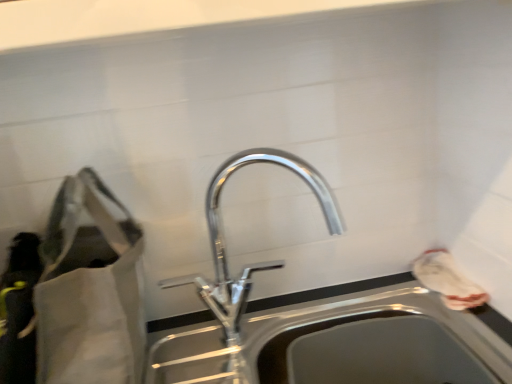
Measure the distance between polished chrome tap at center and camera.

polished chrome tap at center is 29.58 inches away from camera.

Identify the location of polished chrome tap at center. (224, 247).

In the scene shown: From the image's perspective, is white fabric bag at right, arranged as the 2th bag when viewed from the left, located beneath stainless steel sink at center?

Actually, white fabric bag at right, arranged as the 2th bag when viewed from the left, appears above stainless steel sink at center in the image.

From the picture: Between white fabric bag at right, the 1th bag positioned from the right, and stainless steel sink at center, which one is positioned behind?

white fabric bag at right, the 1th bag positioned from the right.

From a real-world perspective, is white fabric bag at right, the 1th bag positioned from the right, positioned above or below stainless steel sink at center?

In terms of real-world spatial position, white fabric bag at right, the 1th bag positioned from the right, is above stainless steel sink at center.

Is white fabric bag at right, the 1th bag positioned from the right, placed right next to stainless steel sink at center?

No, white fabric bag at right, the 1th bag positioned from the right, is not in contact with stainless steel sink at center.

Could you measure the distance between stainless steel sink at center and white fabric bag at right, arranged as the 2th bag when viewed from the left?

stainless steel sink at center is 19.29 centimeters from white fabric bag at right, arranged as the 2th bag when viewed from the left.

In the image, is stainless steel sink at center positioned in front of or behind white fabric bag at right, the 1th bag positioned from the right?

stainless steel sink at center is positioned closer to the viewer than white fabric bag at right, the 1th bag positioned from the right.

Which object is positioned more to the left, stainless steel sink at center or white fabric bag at right, the 1th bag positioned from the right?

stainless steel sink at center.

From the image's perspective, which object appears higher, stainless steel sink at center or white fabric bag at right, arranged as the 2th bag when viewed from the left?

white fabric bag at right, arranged as the 2th bag when viewed from the left, appears higher in the image.

From the image's perspective, is white fabric bag at right, the 1th bag positioned from the right, over polished chrome tap at center?

Actually, white fabric bag at right, the 1th bag positioned from the right, appears below polished chrome tap at center in the image.

How different are the orientations of white fabric bag at right, the 1th bag positioned from the right, and polished chrome tap at center in degrees?

The angular difference between white fabric bag at right, the 1th bag positioned from the right, and polished chrome tap at center is 92.7 degrees.

Between white fabric bag at right, the 1th bag positioned from the right, and polished chrome tap at center, which one is positioned behind?

white fabric bag at right, the 1th bag positioned from the right, is further away from the camera.

Considering the relative sizes of white fabric bag at right, arranged as the 2th bag when viewed from the left, and polished chrome tap at center in the image provided, is white fabric bag at right, arranged as the 2th bag when viewed from the left, wider than polished chrome tap at center?

No.

From the image's perspective, which object appears higher, matte gray bag at left, positioned as the first bag in left-to-right order, or stainless steel sink at center?

matte gray bag at left, positioned as the first bag in left-to-right order.

Looking at this image, considering the sizes of objects matte gray bag at left, positioned as the 2th bag in right-to-left order, and stainless steel sink at center in the image provided, who is thinner, matte gray bag at left, positioned as the 2th bag in right-to-left order, or stainless steel sink at center?

Thinner between the two is stainless steel sink at center.

Would you say matte gray bag at left, positioned as the 2th bag in right-to-left order, contains stainless steel sink at center?

Actually, stainless steel sink at center is outside matte gray bag at left, positioned as the 2th bag in right-to-left order.

Is matte gray bag at left, positioned as the 2th bag in right-to-left order, positioned with its back to stainless steel sink at center?

No, matte gray bag at left, positioned as the 2th bag in right-to-left order, is not facing away from stainless steel sink at center.

Does polished chrome tap at center have a lesser width compared to white fabric bag at right, the 1th bag positioned from the right?

No.

Does polished chrome tap at center appear on the left side of white fabric bag at right, the 1th bag positioned from the right?

Correct, you'll find polished chrome tap at center to the left of white fabric bag at right, the 1th bag positioned from the right.

In the image, is polished chrome tap at center positioned in front of or behind white fabric bag at right, arranged as the 2th bag when viewed from the left?

Clearly, polished chrome tap at center is in front of white fabric bag at right, arranged as the 2th bag when viewed from the left.

Is polished chrome tap at center next to white fabric bag at right, the 1th bag positioned from the right?

No, polished chrome tap at center is not touching white fabric bag at right, the 1th bag positioned from the right.

Based on their sizes in the image, would you say white fabric bag at right, arranged as the 2th bag when viewed from the left, is bigger or smaller than matte gray bag at left, positioned as the first bag in left-to-right order?

Considering their sizes, white fabric bag at right, arranged as the 2th bag when viewed from the left, takes up less space than matte gray bag at left, positioned as the first bag in left-to-right order.

Considering the relative sizes of white fabric bag at right, the 1th bag positioned from the right, and matte gray bag at left, positioned as the first bag in left-to-right order, in the image provided, is white fabric bag at right, the 1th bag positioned from the right, thinner than matte gray bag at left, positioned as the first bag in left-to-right order,?

Correct, the width of white fabric bag at right, the 1th bag positioned from the right, is less than that of matte gray bag at left, positioned as the first bag in left-to-right order.

In the scene shown: Does white fabric bag at right, the 1th bag positioned from the right, appear on the left side of matte gray bag at left, positioned as the first bag in left-to-right order?

In fact, white fabric bag at right, the 1th bag positioned from the right, is to the right of matte gray bag at left, positioned as the first bag in left-to-right order.

Locate an element on the screen. This screenshot has width=512, height=384. bag that appears above the white fabric bag at right, arranged as the 2th bag when viewed from the left (from a real-world perspective) is located at coordinates (90, 290).

From the image's perspective, which object appears higher, polished chrome tap at center or matte gray bag at left, positioned as the first bag in left-to-right order?

polished chrome tap at center.

Consider the image. From a real-world perspective, is polished chrome tap at center over matte gray bag at left, positioned as the 2th bag in right-to-left order?

No, from a real-world perspective, polished chrome tap at center is not over matte gray bag at left, positioned as the 2th bag in right-to-left order

Are polished chrome tap at center and matte gray bag at left, positioned as the 2th bag in right-to-left order, located far from each other?

Actually, polished chrome tap at center and matte gray bag at left, positioned as the 2th bag in right-to-left order, are a little close together.

Who is shorter, polished chrome tap at center or matte gray bag at left, positioned as the first bag in left-to-right order?

polished chrome tap at center.

The width and height of the screenshot is (512, 384). I want to click on the 1st bag above when counting from the stainless steel sink at center (from the image's perspective), so click(x=448, y=280).

Where is `sink on the left of white fabric bag at right, arranged as the 2th bag when viewed from the left`? Image resolution: width=512 pixels, height=384 pixels. sink on the left of white fabric bag at right, arranged as the 2th bag when viewed from the left is located at coordinates (341, 344).

From the image, which object appears to be nearer to white fabric bag at right, arranged as the 2th bag when viewed from the left, matte gray bag at left, positioned as the first bag in left-to-right order, or stainless steel sink at center?

stainless steel sink at center.

Looking at the image, which one is located further to stainless steel sink at center, white fabric bag at right, arranged as the 2th bag when viewed from the left, or polished chrome tap at center?

white fabric bag at right, arranged as the 2th bag when viewed from the left, lies further to stainless steel sink at center than the other object.

Estimate the real-world distances between objects in this image. Which object is further from stainless steel sink at center, matte gray bag at left, positioned as the first bag in left-to-right order, or polished chrome tap at center?

The object further to stainless steel sink at center is matte gray bag at left, positioned as the first bag in left-to-right order.

When comparing their distances from polished chrome tap at center, does matte gray bag at left, positioned as the first bag in left-to-right order, or white fabric bag at right, the 1th bag positioned from the right, seem further?

white fabric bag at right, the 1th bag positioned from the right, lies further to polished chrome tap at center than the other object.

Considering their positions, is polished chrome tap at center positioned closer to white fabric bag at right, arranged as the 2th bag when viewed from the left, than stainless steel sink at center?

stainless steel sink at center.

Estimate the real-world distances between objects in this image. Which object is further from matte gray bag at left, positioned as the first bag in left-to-right order, polished chrome tap at center or stainless steel sink at center?

Based on the image, stainless steel sink at center appears to be further to matte gray bag at left, positioned as the first bag in left-to-right order.

Looking at the image, which one is located further to polished chrome tap at center, matte gray bag at left, positioned as the first bag in left-to-right order, or stainless steel sink at center?

Based on the image, matte gray bag at left, positioned as the first bag in left-to-right order, appears to be further to polished chrome tap at center.

Considering their positions, is stainless steel sink at center positioned closer to polished chrome tap at center than matte gray bag at left, positioned as the 2th bag in right-to-left order?

stainless steel sink at center lies closer to polished chrome tap at center than the other object.

Find the location of a particular element. Image resolution: width=512 pixels, height=384 pixels. tap located between matte gray bag at left, positioned as the first bag in left-to-right order, and stainless steel sink at center in the left-right direction is located at coordinates (224, 247).

Identify the location of sink between polished chrome tap at center and white fabric bag at right, arranged as the 2th bag when viewed from the left, in the horizontal direction. Image resolution: width=512 pixels, height=384 pixels. (341, 344).

Image resolution: width=512 pixels, height=384 pixels. I want to click on tap between matte gray bag at left, positioned as the 2th bag in right-to-left order, and white fabric bag at right, arranged as the 2th bag when viewed from the left, so click(224, 247).

You are a GUI agent. You are given a task and a screenshot of the screen. Output one action in this format:
    pyautogui.click(x=<x>, y=<y>)
    Task: Click on the sink between matte gray bag at left, positioned as the first bag in left-to-right order, and white fabric bag at right, the 1th bag positioned from the right, from left to right
    Image resolution: width=512 pixels, height=384 pixels.
    Given the screenshot: What is the action you would take?
    pyautogui.click(x=341, y=344)